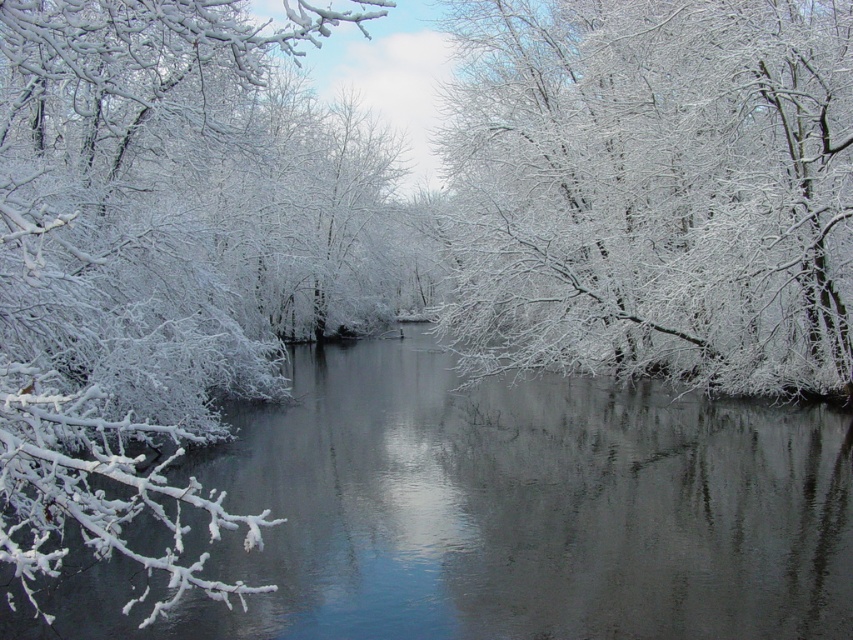
Is point (828, 60) positioned before point (54, 193)?

No.

Which is in front, point (770, 3) or point (213, 88)?

Positioned in front is point (770, 3).

This screenshot has width=853, height=640. What are the coordinates of `white frosty branches at upper center` in the screenshot? It's located at tap(654, 189).